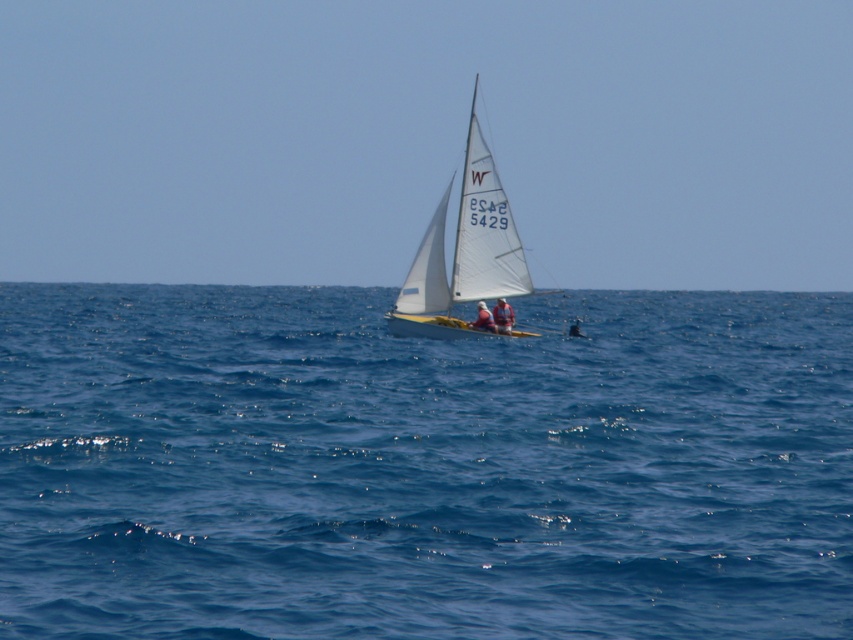
Question: Which object appears closest to the camera in this image?

Choices:
 (A) blue water at center
 (B) white sailboat at center

Answer: (A)

Question: Among these points, which one is farthest from the camera?

Choices:
 (A) pyautogui.click(x=447, y=317)
 (B) pyautogui.click(x=531, y=529)

Answer: (A)

Question: Can you confirm if blue water at center is positioned above white sailboat at center?

Choices:
 (A) no
 (B) yes

Answer: (A)

Question: Does blue water at center appear over white sailboat at center?

Choices:
 (A) no
 (B) yes

Answer: (A)

Question: Which point appears farthest from the camera in this image?

Choices:
 (A) (479, 228)
 (B) (80, 403)

Answer: (A)

Question: Can you confirm if blue water at center is positioned above white sailboat at center?

Choices:
 (A) no
 (B) yes

Answer: (A)